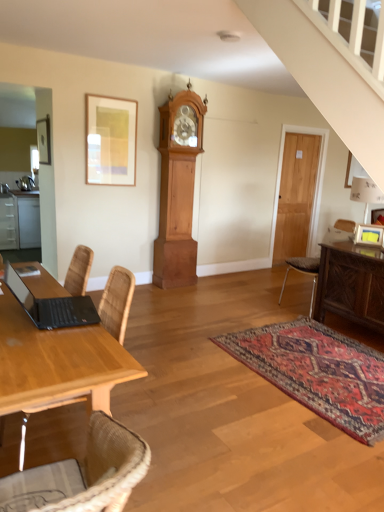
Question: Considering the relative sizes of black matte laptop at lower left and wooden table at left in the image provided, is black matte laptop at lower left wider than wooden table at left?

Choices:
 (A) no
 (B) yes

Answer: (A)

Question: Is black matte laptop at lower left completely or partially outside of wooden table at left?

Choices:
 (A) no
 (B) yes

Answer: (B)

Question: Is wooden table at left a part of black matte laptop at lower left?

Choices:
 (A) no
 (B) yes

Answer: (A)

Question: From a real-world perspective, does black matte laptop at lower left stand above wooden table at left?

Choices:
 (A) no
 (B) yes

Answer: (B)

Question: Is black matte laptop at lower left at the left side of wooden table at left?

Choices:
 (A) no
 (B) yes

Answer: (A)

Question: Can you confirm if black matte laptop at lower left is shorter than wooden table at left?

Choices:
 (A) yes
 (B) no

Answer: (A)

Question: Is carved wood sideboard at right in front of brown leather chair at right?

Choices:
 (A) no
 (B) yes

Answer: (B)

Question: Can you confirm if carved wood sideboard at right is taller than brown leather chair at right?

Choices:
 (A) yes
 (B) no

Answer: (B)

Question: Can you confirm if carved wood sideboard at right is thinner than brown leather chair at right?

Choices:
 (A) yes
 (B) no

Answer: (A)

Question: Is carved wood sideboard at right oriented towards brown leather chair at right?

Choices:
 (A) yes
 (B) no

Answer: (B)

Question: Is carved wood sideboard at right not inside brown leather chair at right?

Choices:
 (A) no
 (B) yes

Answer: (B)

Question: Is carved wood sideboard at right behind brown leather chair at right?

Choices:
 (A) yes
 (B) no

Answer: (B)

Question: Can you confirm if wooden door at right is taller than black matte laptop at lower left?

Choices:
 (A) no
 (B) yes

Answer: (B)